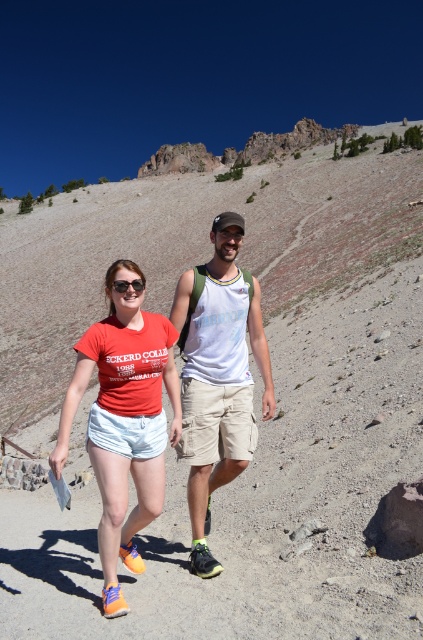
Looking at this image, you are a photographer trying to capture a closeup of the white cotton tank top at center and the matte black sunglasses at center. Which object should you focus on first to ensure it appears sharp in the photo?

The white cotton tank top at center is closer to the viewer than the matte black sunglasses at center, so you should focus on the white cotton tank top at center first to ensure it appears sharp in the photo.